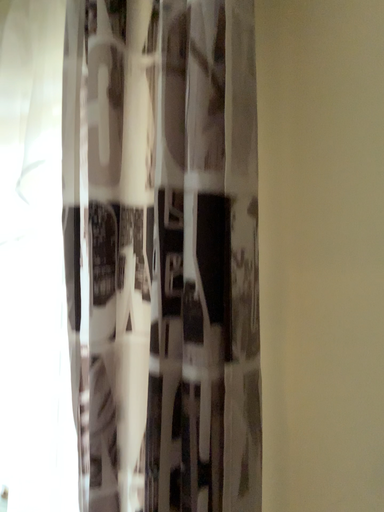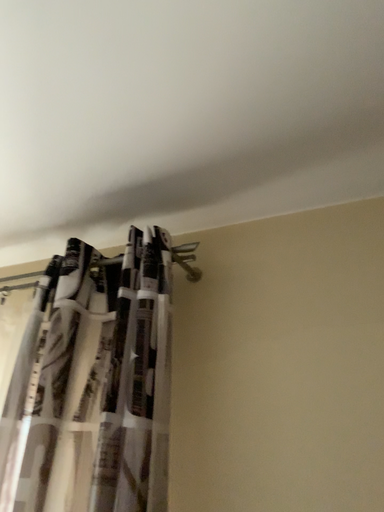
Question: How did the camera likely rotate when shooting the video?

Choices:
 (A) rotated upward
 (B) rotated downward

Answer: (A)